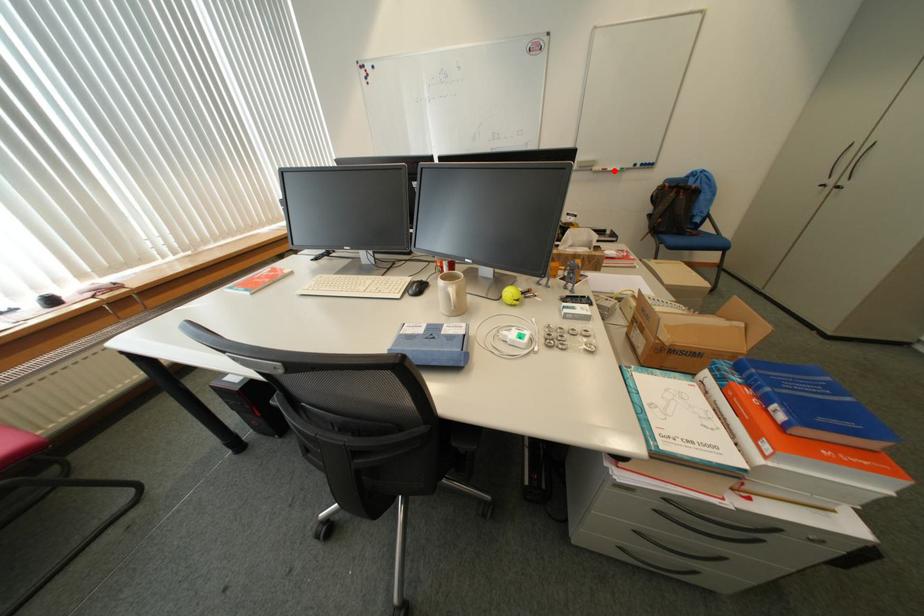
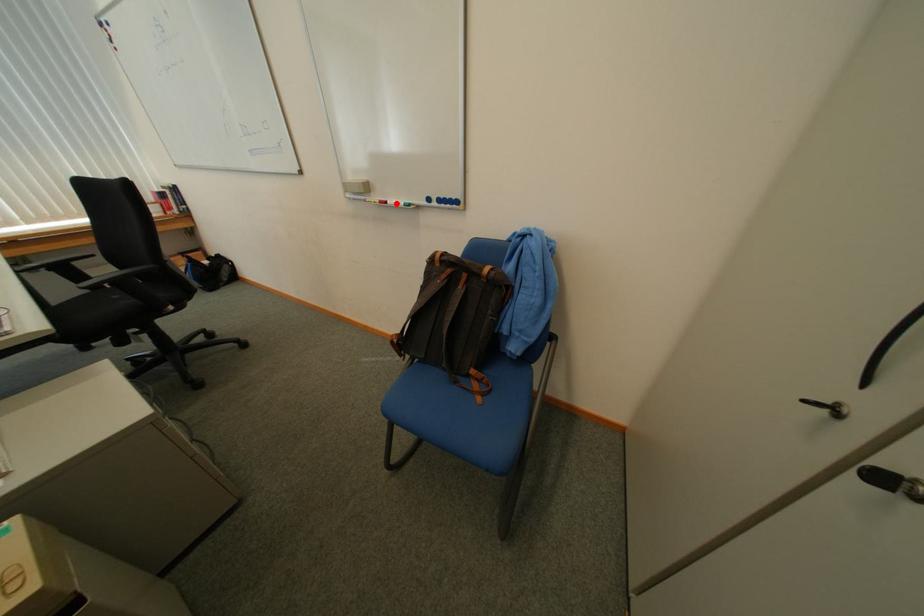
I am providing you with two images of the same scene from different viewpoints. A red point is marked on the first image and another point is marked on the second image. Are the points marked in image1 and image2 representing the same 3D position?

Yes